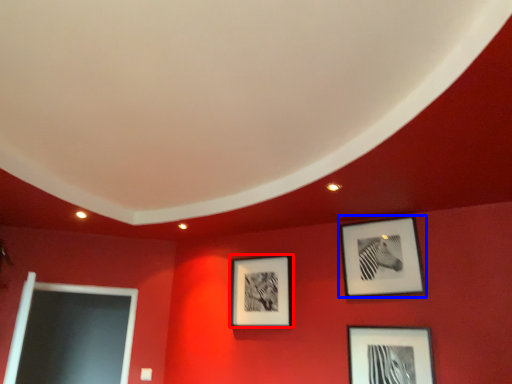
Question: Which object appears farthest to the camera in this image, picture frame (highlighted by a red box) or picture frame (highlighted by a blue box)?

Choices:
 (A) picture frame
 (B) picture frame

Answer: (A)